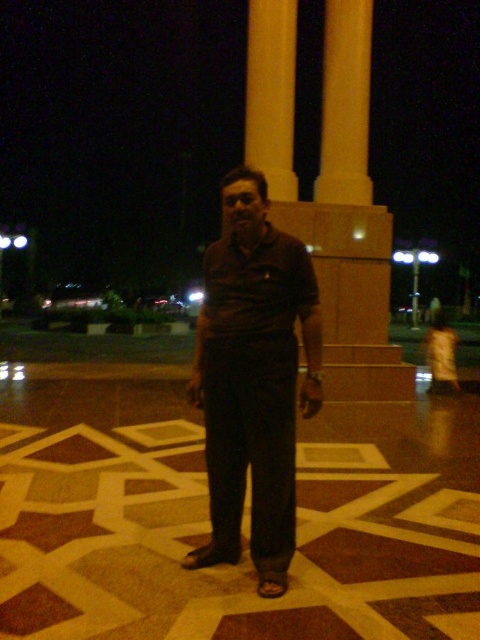
Question: Considering the relative positions of matte brown shirt at center and yellow polished stone pillar at upper center in the image provided, where is matte brown shirt at center located with respect to yellow polished stone pillar at upper center?

Choices:
 (A) left
 (B) right

Answer: (A)

Question: In this image, where is matte brown shirt at center located relative to yellow polished stone pillar at upper center?

Choices:
 (A) above
 (B) below

Answer: (B)

Question: Is matte brown shirt at center in front of yellow polished stone pillar at upper center?

Choices:
 (A) no
 (B) yes

Answer: (B)